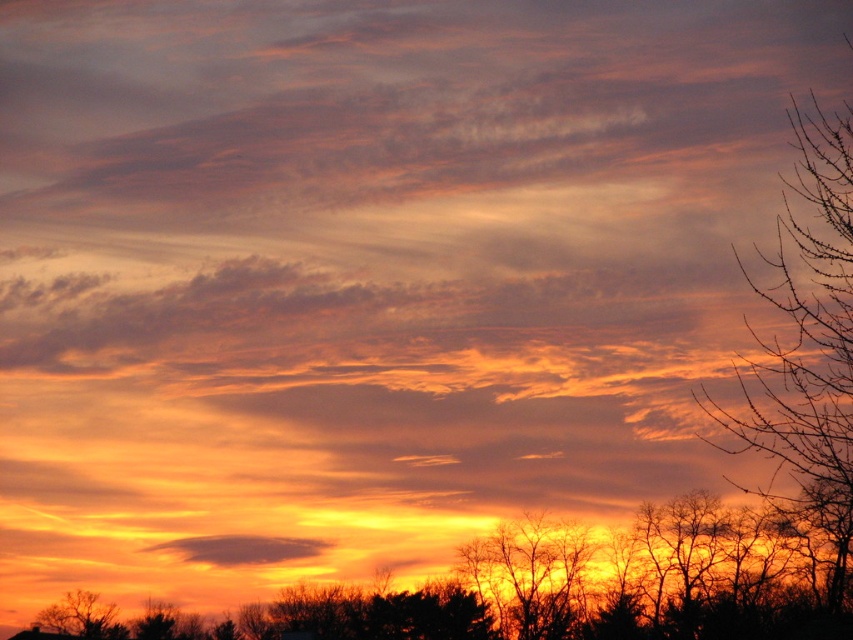
You are an artist trying to paint this sunset scene. You want to ensure the layers of the trees are accurate. Which object should you paint first, the silhouette bare tree at bottom or the bare branches at right?

Since the bare branches at right are behind the silhouette bare tree at bottom, you should paint the silhouette bare tree at bottom first to create the foreground layer, then add the bare branches at right in the background.

You are an artist trying to sketch the sunset scene. You notice two elements in the foreground that contrast with the vibrant sky. Which of the two objects, the bare branches at right or the silhouette bare tree at lower left, would you need to draw with more detail due to its size?

The bare branches at right has a larger size compared to the silhouette bare tree at lower left, so you would need to draw the bare branches at right with more detail due to its size.